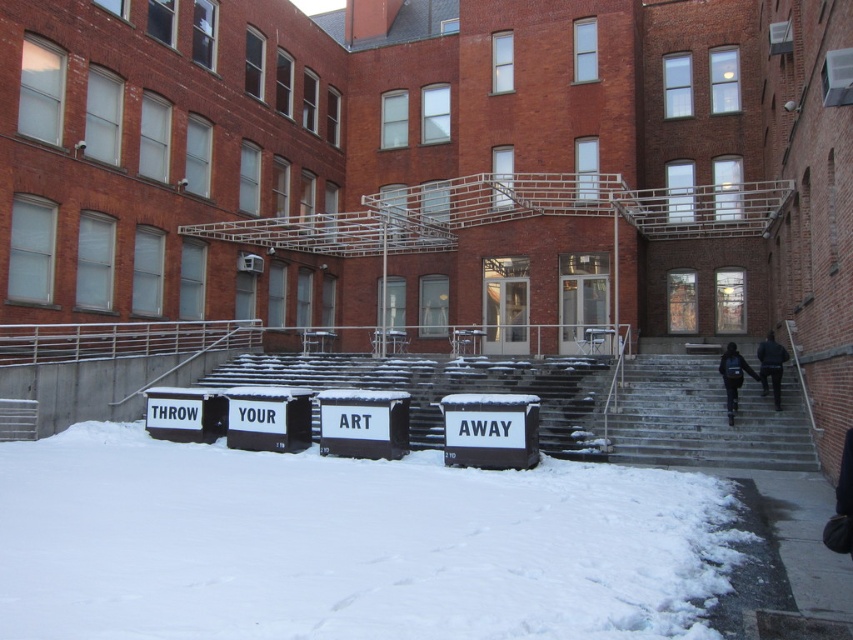
Question: Which is farther from the white powdery snow at lower center?

Choices:
 (A) dark blue jacket at upper right
 (B) snow-covered concrete stairs at center
 (C) smooth concrete stairs at right
 (D) black fabric jacket at upper right

Answer: (D)

Question: Does white powdery snow at lower center have a lesser width compared to smooth concrete stairs at right?

Choices:
 (A) yes
 (B) no

Answer: (B)

Question: Can you confirm if white powdery snow at lower center is positioned below smooth concrete stairs at right?

Choices:
 (A) yes
 (B) no

Answer: (A)

Question: Which point is farther to the camera?

Choices:
 (A) smooth concrete stairs at right
 (B) black fabric jacket at upper right

Answer: (A)

Question: Is snow-covered concrete stairs at center below dark blue jacket at upper right?

Choices:
 (A) no
 (B) yes

Answer: (B)

Question: Which of these objects is positioned closest to the smooth concrete stairs at right?

Choices:
 (A) dark blue jacket at upper right
 (B) white powdery snow at lower center
 (C) black fabric jacket at upper right

Answer: (A)